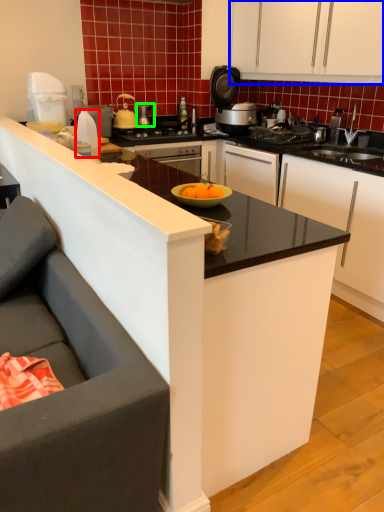
Question: Which object is the closest to the kitchen appliance (highlighted by a red box)? Choose among these: cabinetry (highlighted by a blue box) or kitchen appliance (highlighted by a green box).

Choices:
 (A) cabinetry
 (B) kitchen appliance

Answer: (B)